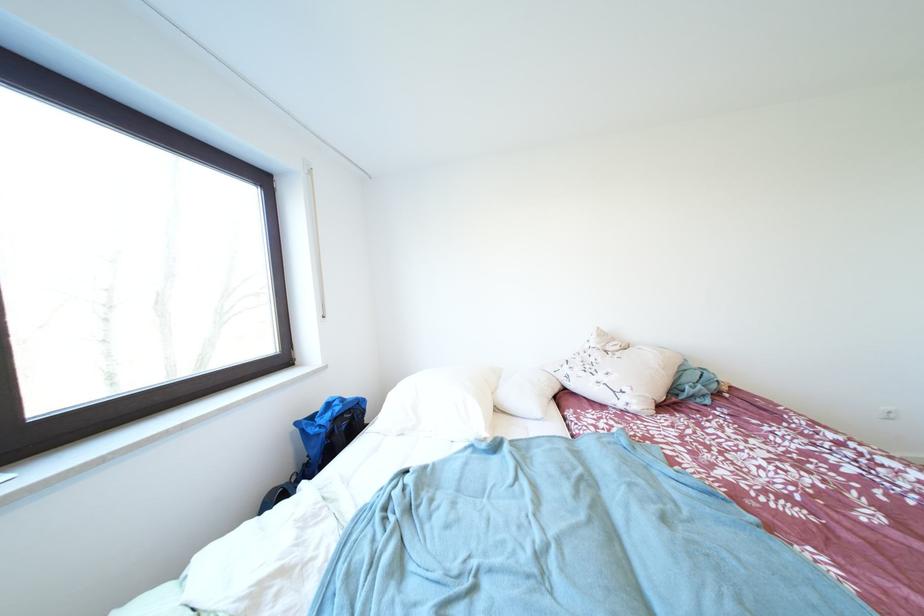
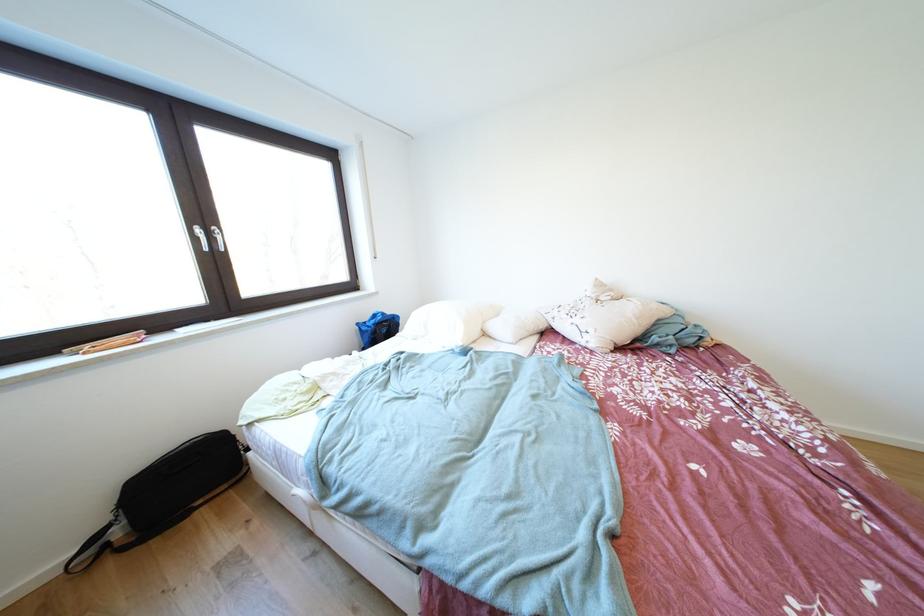
Where in the second image is the point corresponding to (305,428) from the first image?

(367, 329)